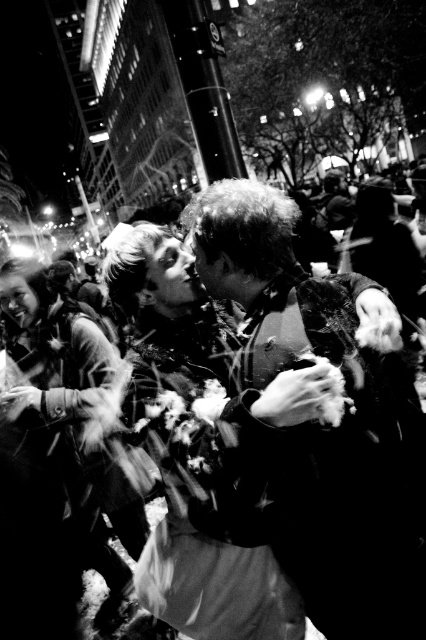
In the black and white photograph of the urban night scene, there is a point at coordinates (204, 449). What object is located at this point?

The point at coordinates (204, 449) indicates a matte fabric dress at center.

You are a photographer standing in the crowd and want to take a photo of both the point at coordinates point (373, 380) and point (322, 413). Which point is closer to you?

Point (322, 413) is closer to you because it is less further than point (373, 380).